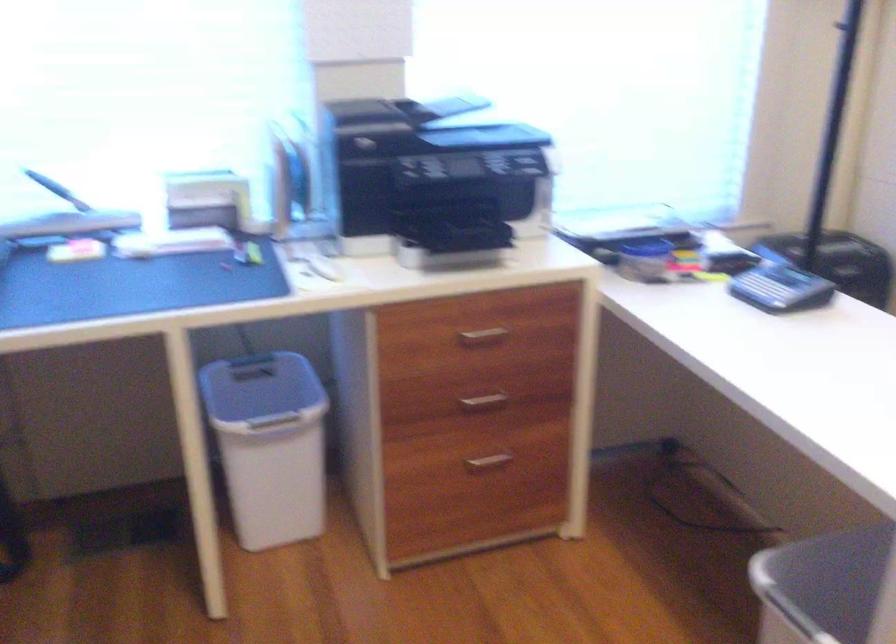
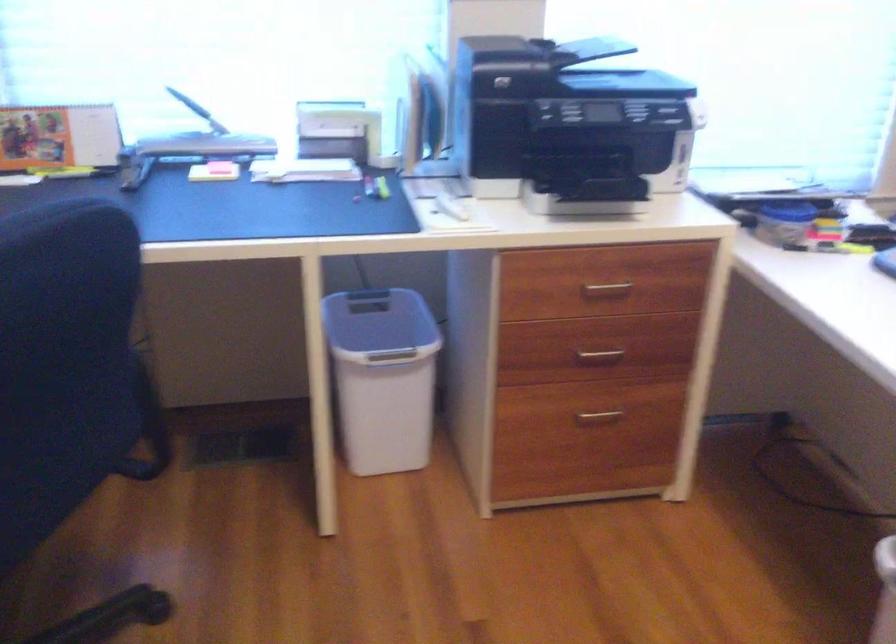
Question: Which direction would the cameraman need to move to produce the second image? Reply with the corresponding letter.

Choices:
 (A) Left
 (B) Right
 (C) Forward
 (D) Backward

Answer: (A)